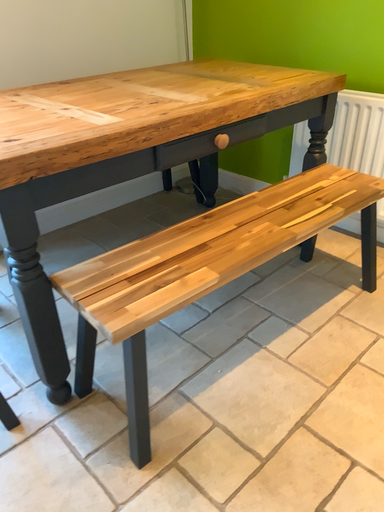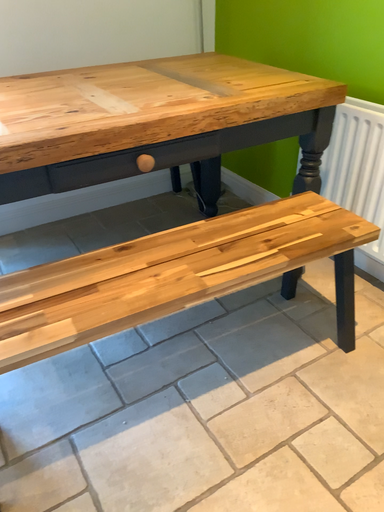
Question: How did the camera likely rotate when shooting the video?

Choices:
 (A) rotated right
 (B) rotated left

Answer: (B)